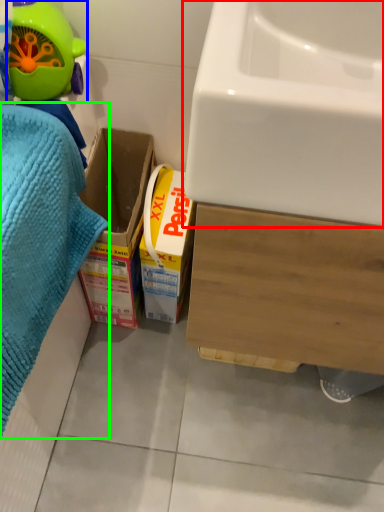
Question: Which object is positioned farthest from sink (highlighted by a red box)? Select from toy (highlighted by a blue box) and bath towel (highlighted by a green box).

Choices:
 (A) toy
 (B) bath towel

Answer: (A)